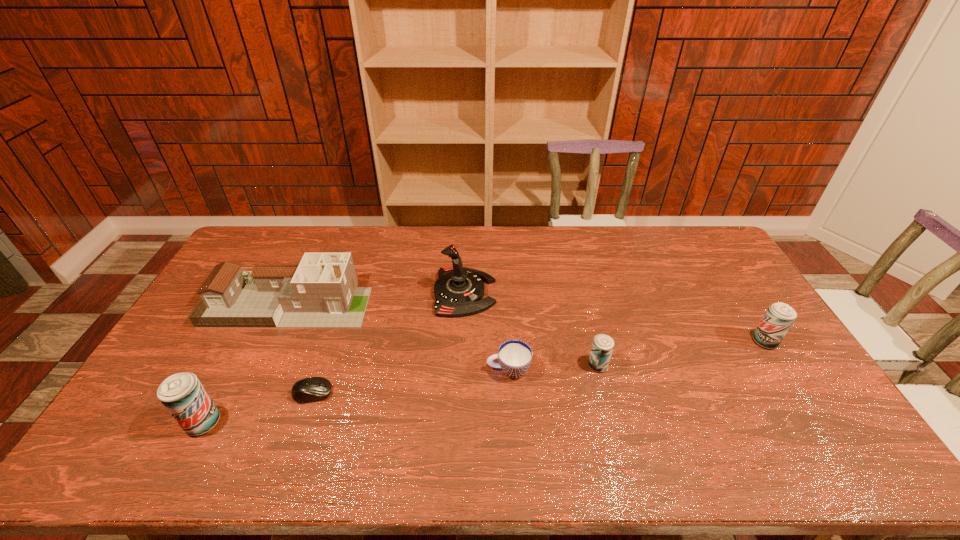
Identify which object is the fourth closest to the joystick. Please provide its 2D coordinates. Your answer should be formatted as a tuple, i.e. [(x, y)], where the tuple contains the x and y coordinates of a point satisfying the conditions above.

[(311, 389)]

Locate which object is the second closest to the cup. Please provide its 2D coordinates. Your answer should be formatted as a tuple, i.e. [(x, y)], where the tuple contains the x and y coordinates of a point satisfying the conditions above.

[(602, 347)]

Identify the location of beer can identified as the closest to the joystick. (602, 347).

You are a GUI agent. You are given a task and a screenshot of the screen. Output one action in this format:
    pyautogui.click(x=<x>, y=<y>)
    Task: Click on the beer can that stands as the closest to the fifth tallest object
    
    Given the screenshot: What is the action you would take?
    pyautogui.click(x=779, y=317)

This screenshot has width=960, height=540. What are the coordinates of `vacant space that satisfies the following two spatial constraints: 1. at the main entrance of the dollhouse; 2. on the back side of the mouse` in the screenshot? It's located at click(247, 393).

You are a GUI agent. You are given a task and a screenshot of the screen. Output one action in this format:
    pyautogui.click(x=<x>, y=<y>)
    Task: Click on the free region that satisfies the following two spatial constraints: 1. on the handle side of the second tallest beer can; 2. on the left side of the joystick
    This screenshot has height=540, width=960.
    Given the screenshot: What is the action you would take?
    pyautogui.click(x=462, y=341)

Identify the location of vacant point that satisfies the following two spatial constraints: 1. on the back side of the rightmost object; 2. on the handle side of the joystick. (733, 293).

Identify the location of free location that satisfies the following two spatial constraints: 1. on the handle side of the joystick; 2. on the left side of the rightmost object. (462, 341).

Find the location of a particular element. vacant position in the image that satisfies the following two spatial constraints: 1. at the main entrance of the dollhouse; 2. on the back side of the second beer can from left to right is located at coordinates (260, 366).

The height and width of the screenshot is (540, 960). I want to click on blank area in the image that satisfies the following two spatial constraints: 1. on the handle side of the joystick; 2. on the left side of the farthest beer can, so click(x=462, y=341).